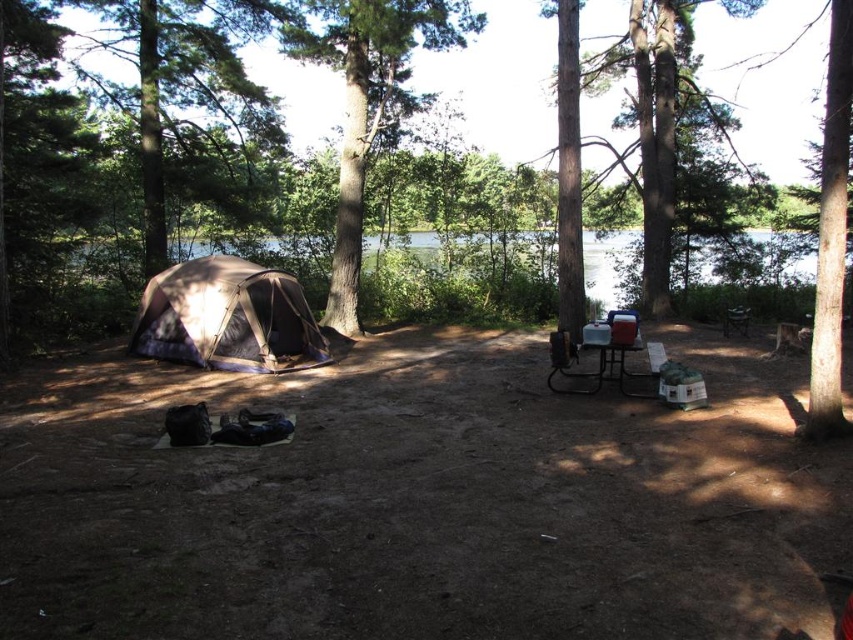
Question: Among these points, which one is nearest to the camera?

Choices:
 (A) pyautogui.click(x=376, y=90)
 (B) pyautogui.click(x=648, y=371)
 (C) pyautogui.click(x=253, y=6)

Answer: (B)

Question: Does clear water at center appear under metallic silver chair at center-right?

Choices:
 (A) yes
 (B) no

Answer: (B)

Question: Based on their relative distances, which object is farther from the brown canvas tent at left?

Choices:
 (A) brown textured tent at left
 (B) metallic silver chair at center-right
 (C) brown textured tree at upper center
 (D) green leafy tree at upper left

Answer: (C)

Question: Is brown textured tent at left to the right of brown canvas tent at left from the viewer's perspective?

Choices:
 (A) no
 (B) yes

Answer: (B)

Question: Can you confirm if brown textured tent at left is thinner than metallic silver picnic table at center?

Choices:
 (A) yes
 (B) no

Answer: (B)

Question: Which object is the closest to the brown canvas tent at left?

Choices:
 (A) brown textured tent at left
 (B) brown textured tree at upper center
 (C) metallic silver picnic table at center
 (D) clear water at center

Answer: (A)